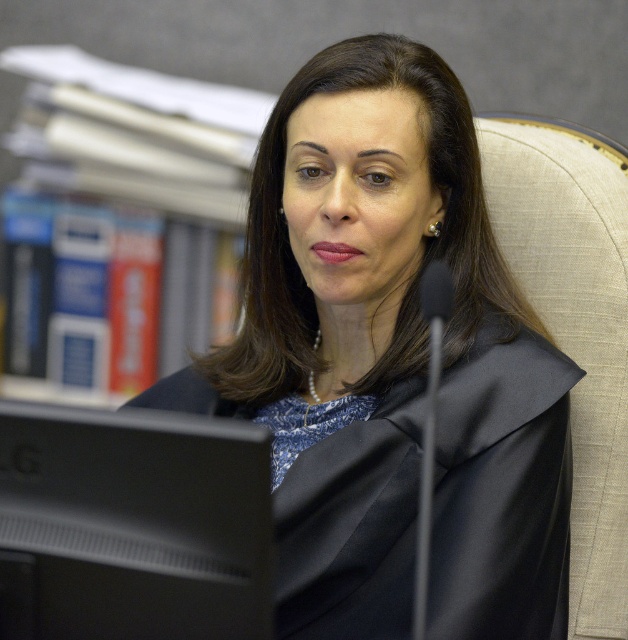
Can you confirm if matte black robe at center is taller than black matte monitor at lower left?

Correct, matte black robe at center is much taller as black matte monitor at lower left.

Is matte black robe at center to the right of black matte monitor at lower left from the viewer's perspective?

Correct, you'll find matte black robe at center to the right of black matte monitor at lower left.

Describe the element at coordinates (391, 364) in the screenshot. I see `matte black robe at center` at that location.

The width and height of the screenshot is (628, 640). In order to click on matte black robe at center in this screenshot , I will do `click(391, 364)`.